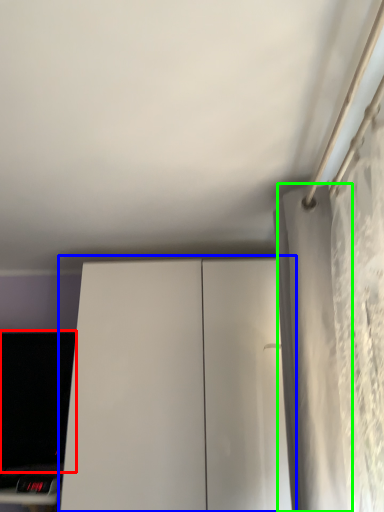
Question: Which object is the closest to the computer monitor (highlighted by a red box)? Choose among these: dresser (highlighted by a blue box) or curtain (highlighted by a green box).

Choices:
 (A) dresser
 (B) curtain

Answer: (A)